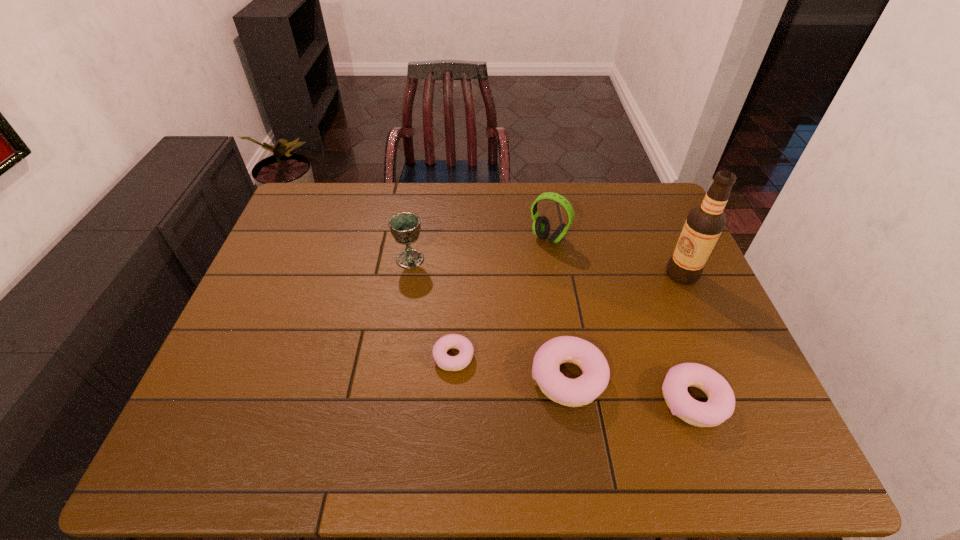
In order to click on empty location between the headset and the second doughnut from right to left in this screenshot , I will do `click(559, 308)`.

You are a GUI agent. You are given a task and a screenshot of the screen. Output one action in this format:
    pyautogui.click(x=<x>, y=<y>)
    Task: Click on the unoccupied position between the alcohol and the chalice
    Image resolution: width=960 pixels, height=540 pixels.
    Given the screenshot: What is the action you would take?
    pyautogui.click(x=546, y=267)

Find the location of a particular element. vacant region between the shortest doughnut and the rightmost doughnut is located at coordinates (573, 379).

In order to click on vacant area that lies between the rightmost doughnut and the leftmost doughnut in this screenshot , I will do `click(573, 379)`.

Identify the location of vacant region between the chalice and the alcohol. The height and width of the screenshot is (540, 960). (546, 267).

Find the location of a particular element. object that stands as the third closest to the second tallest doughnut is located at coordinates (449, 363).

Choose which object is the third nearest neighbor to the headset. Please provide its 2D coordinates. Your answer should be formatted as a tuple, i.e. [(x, y)], where the tuple contains the x and y coordinates of a point satisfying the conditions above.

[(583, 390)]

Where is `doughnut object that ranks as the second closest to the leftmost object`? The image size is (960, 540). doughnut object that ranks as the second closest to the leftmost object is located at coordinates (583, 390).

At what (x,y) coordinates should I click in order to perform the action: click on the second closest doughnut to the chalice. Please return your answer as a coordinate pair (x, y). This screenshot has height=540, width=960. Looking at the image, I should click on (583, 390).

I want to click on free space that satisfies the following two spatial constraints: 1. on the front side of the farthest object; 2. on the right side of the second tallest doughnut, so (x=575, y=401).